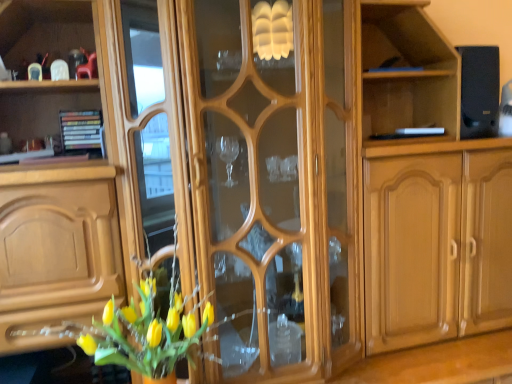
This screenshot has height=384, width=512. What do you see at coordinates (143, 328) in the screenshot?
I see `yellow glass vase at center` at bounding box center [143, 328].

What is the approximate height of yellow glass vase at center?

yellow glass vase at center is 27.96 inches in height.

Where is `yellow glass vase at center`? yellow glass vase at center is located at coordinates (143, 328).

This screenshot has width=512, height=384. Find the location of `yellow glass vase at center`. yellow glass vase at center is located at coordinates (143, 328).